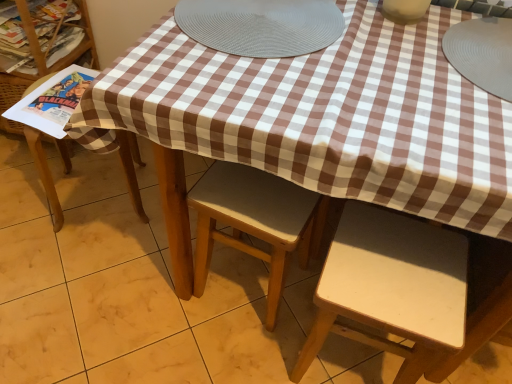
The height and width of the screenshot is (384, 512). In order to click on empty space that is ontop of white matte chair at lower right, positioned as the 3th chair in left-to-right order (from a real-world perspective) in this screenshot , I will do `click(397, 263)`.